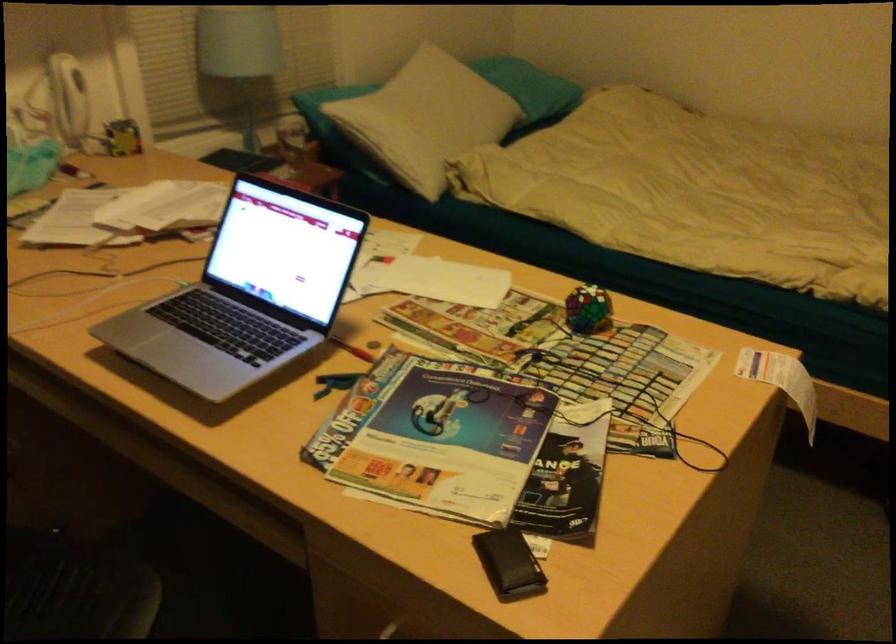
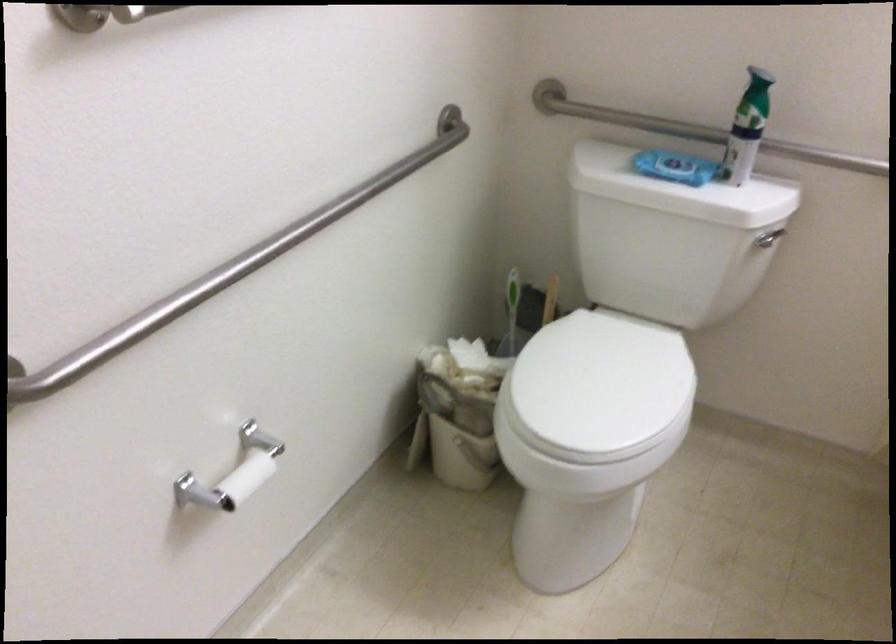
Question: What movement of the cameraman would produce the second image?

Choices:
 (A) Left
 (B) Right
 (C) Forward
 (D) Backward

Answer: (B)